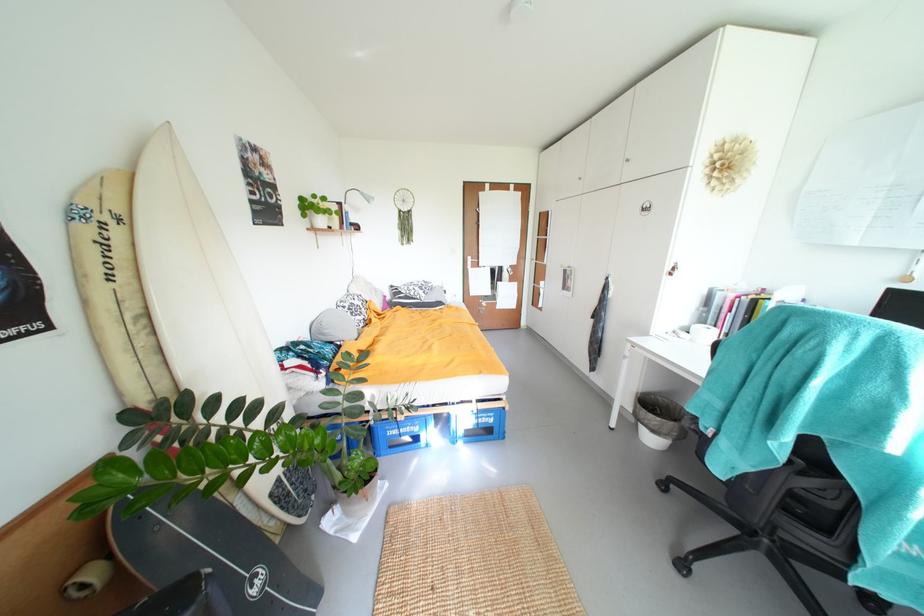
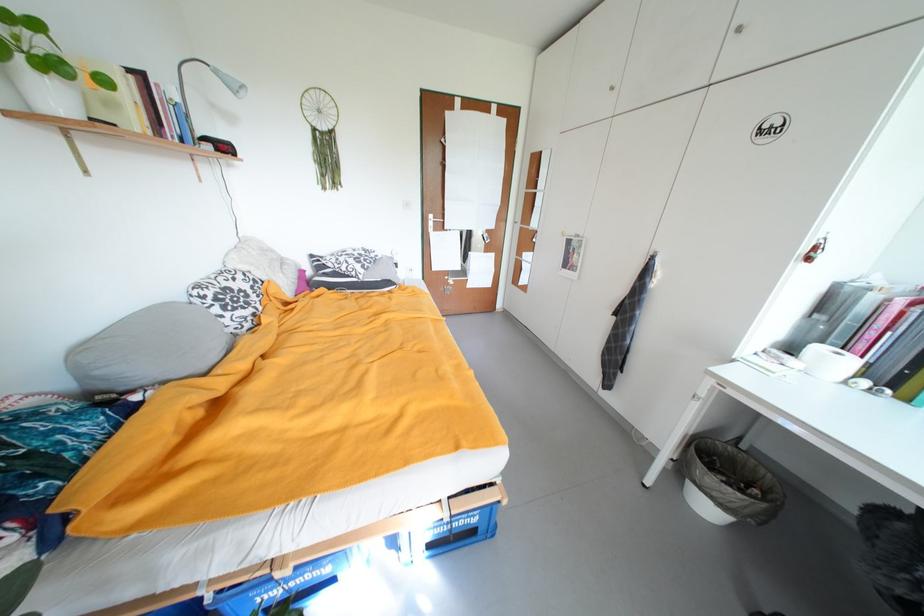
The point at (x=377, y=201) is marked in the first image. Where is the corresponding point in the second image?

(244, 90)